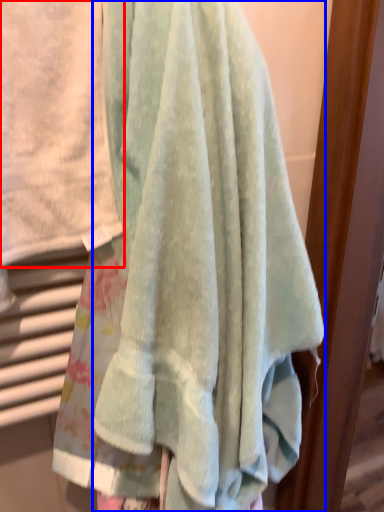
Question: Which object appears closest to the camera in this image, towel (highlighted by a red box) or towel (highlighted by a blue box)?

Choices:
 (A) towel
 (B) towel

Answer: (A)